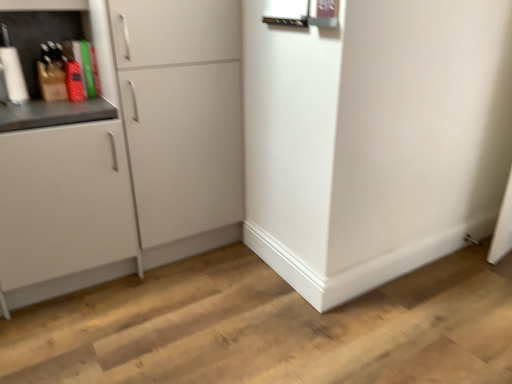
Question: Considering the relative positions of white matte cabinet at left, the 1th cabinetry from the left, and white matte cabinet at left, which is the first cabinetry from right to left, in the image provided, is white matte cabinet at left, the 1th cabinetry from the left, in front of white matte cabinet at left, which is the first cabinetry from right to left,?

Choices:
 (A) yes
 (B) no

Answer: (A)

Question: Is white matte cabinet at left, placed as the second cabinetry when sorted from right to left, next to white matte cabinet at left, which is the 2th cabinetry in left-to-right order, and touching it?

Choices:
 (A) yes
 (B) no

Answer: (B)

Question: From the image's perspective, is white matte cabinet at left, placed as the second cabinetry when sorted from right to left, over white matte cabinet at left, which is the 2th cabinetry in left-to-right order?

Choices:
 (A) yes
 (B) no

Answer: (B)

Question: Is white matte cabinet at left, placed as the second cabinetry when sorted from right to left, wider than white matte cabinet at left, which is the first cabinetry from right to left?

Choices:
 (A) no
 (B) yes

Answer: (B)

Question: Can you confirm if white matte cabinet at left, placed as the second cabinetry when sorted from right to left, is thinner than white matte cabinet at left, which is the first cabinetry from right to left?

Choices:
 (A) yes
 (B) no

Answer: (B)

Question: From a real-world perspective, is white matte cabinet at left, placed as the second cabinetry when sorted from right to left, physically above white matte cabinet at left, which is the first cabinetry from right to left?

Choices:
 (A) no
 (B) yes

Answer: (A)

Question: From the image's perspective, is white matte cabinet at left, which is the first cabinetry from right to left, located beneath white matte cabinet at left, the 1th cabinetry from the left?

Choices:
 (A) no
 (B) yes

Answer: (A)

Question: Is white matte cabinet at left, which is the 2th cabinetry in left-to-right order, positioned behind white matte cabinet at left, placed as the second cabinetry when sorted from right to left?

Choices:
 (A) no
 (B) yes

Answer: (B)

Question: Does white matte cabinet at left, which is the first cabinetry from right to left, appear on the right side of white matte cabinet at left, the 1th cabinetry from the left?

Choices:
 (A) no
 (B) yes

Answer: (B)

Question: Considering the relative sizes of white matte cabinet at left, which is the 2th cabinetry in left-to-right order, and white matte cabinet at left, the 1th cabinetry from the left, in the image provided, is white matte cabinet at left, which is the 2th cabinetry in left-to-right order, smaller than white matte cabinet at left, the 1th cabinetry from the left,?

Choices:
 (A) yes
 (B) no

Answer: (B)

Question: Is white matte cabinet at left, which is the first cabinetry from right to left, not near white matte cabinet at left, the 1th cabinetry from the left?

Choices:
 (A) yes
 (B) no

Answer: (B)

Question: From the image's perspective, is white matte cabinet at left, which is the 2th cabinetry in left-to-right order, over white matte cabinet at left, placed as the second cabinetry when sorted from right to left?

Choices:
 (A) no
 (B) yes

Answer: (B)

Question: Considering their positions, is white matte cabinet at left, the 1th cabinetry from the left, located in front of or behind white matte cabinet at left, which is the 2th cabinetry in left-to-right order?

Choices:
 (A) front
 (B) behind

Answer: (A)